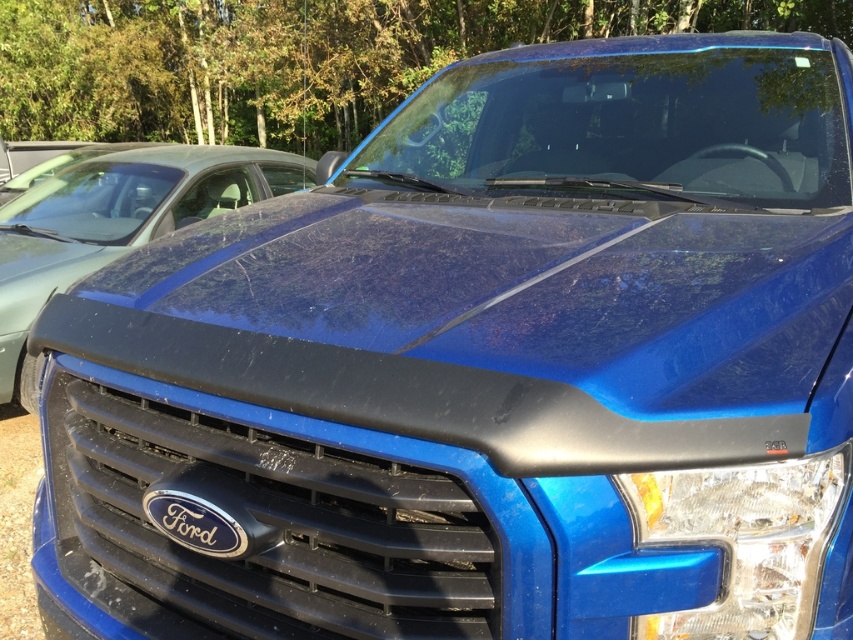
You are a delivery person trying to place a package on the hood of the blue Ford vehicle. The package requires a flat surface that is at least as tall as the black glossy ford emblem at center. Can the matte black hood at center provide a suitable surface for this package?

The matte black hood at center has a greater height compared to the black glossy ford emblem at center. Since the hood is taller than the emblem, it meets the requirement of being at least as tall as the emblem. Therefore, the matte black hood at center can provide a suitable surface for the package.

You are a mechanic working on the blue Ford truck. You need to replace a part that is larger than the clear plastic headlight at lower right. Which part can you replace using the matte black hood at center as a reference?

The matte black hood at center is larger in size than the clear plastic headlight at lower right, so you can use it as a reference to replace parts that require a larger size, such as the hood itself or other larger components.

You are a car detailer inspecting the front of a blue Ford pickup truck. You notice the matte black hood at center and the black glossy ford emblem at center. Which object is located to the right of the other?

The black glossy ford emblem at center is located to the right of the matte black hood at center because the matte black hood at center is positioned on the left side of the black glossy ford emblem at center.